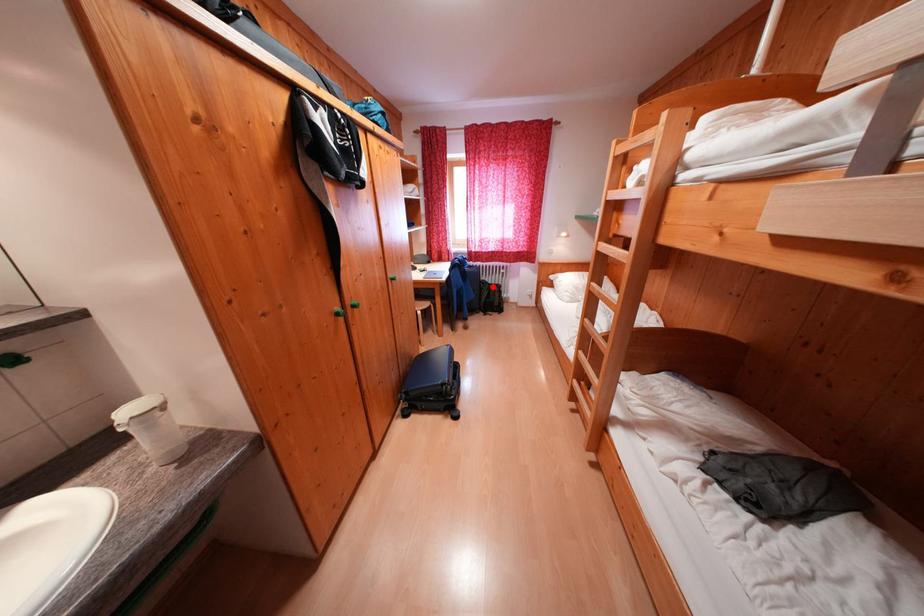
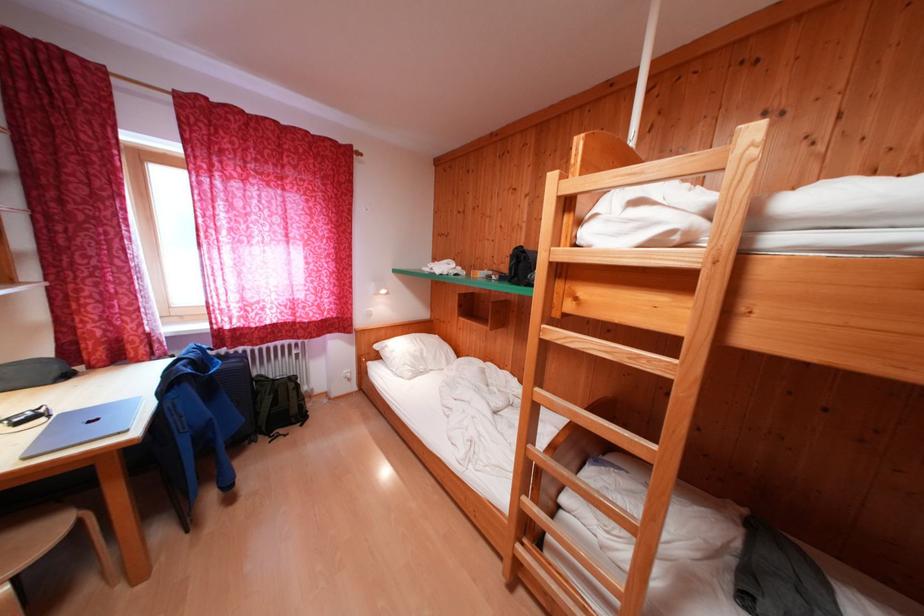
In the second image, find the point that corresponds to the highlighted location in the first image.

(271, 383)